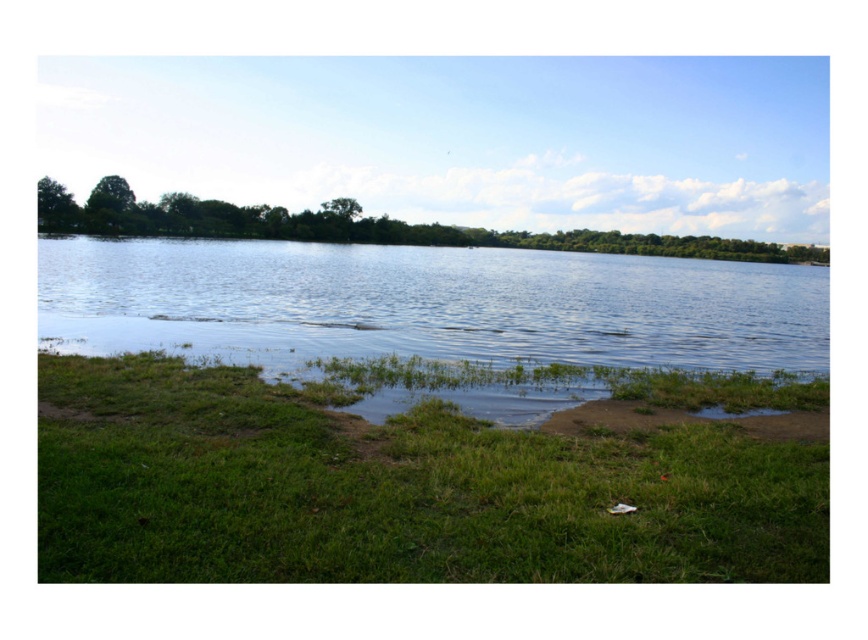
You are standing at the edge of the lake and notice a point marked at coordinates (393,490). What is the terrain like at that location?

The terrain at point (393,490) is green grassy at lower left.

You are standing at the edge of the lake and want to walk towards the clear water at center. Which direction should you move relative to the green grassy at lower left?

You should move away from the green grassy at lower left towards the clear water at center since the grass is located below the water in the image.